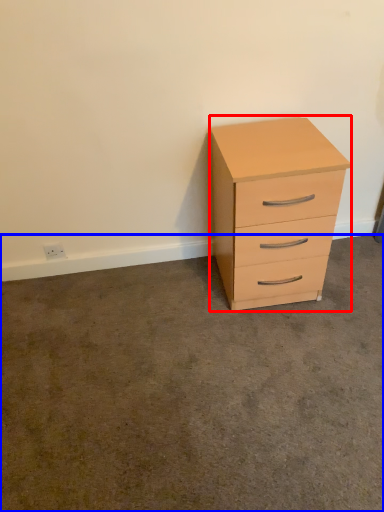
Question: Which object appears closest to the camera in this image, chest of drawers (highlighted by a red box) or concrete (highlighted by a blue box)?

Choices:
 (A) chest of drawers
 (B) concrete

Answer: (B)